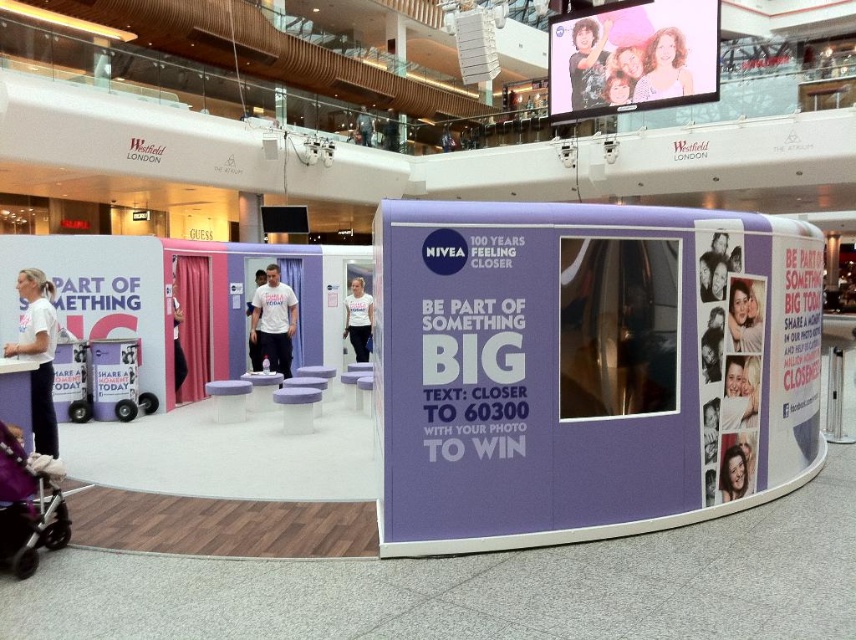
Question: Considering the relative positions of purple fabric baby carriage at lower left and shiny black hair at upper center in the image provided, where is purple fabric baby carriage at lower left located with respect to shiny black hair at upper center?

Choices:
 (A) right
 (B) left

Answer: (B)

Question: Which object is the closest to the purple fabric baby carriage at lower left?

Choices:
 (A) white t-shirt at lower left
 (B) white matte t-shirt at center

Answer: (A)

Question: Which of the following is the farthest from the observer?

Choices:
 (A) white cotton t-shirt at center
 (B) purple fabric baby carriage at lower left

Answer: (A)

Question: Based on their relative distances, which object is nearer to the white matte t-shirt at center?

Choices:
 (A) white t-shirt at lower left
 (B) matte plastic stool at center

Answer: (B)

Question: Is white t-shirt at lower left above shiny black hair at upper center?

Choices:
 (A) no
 (B) yes

Answer: (A)

Question: Does white t-shirt at lower left have a smaller size compared to white cotton t-shirt at center?

Choices:
 (A) yes
 (B) no

Answer: (B)